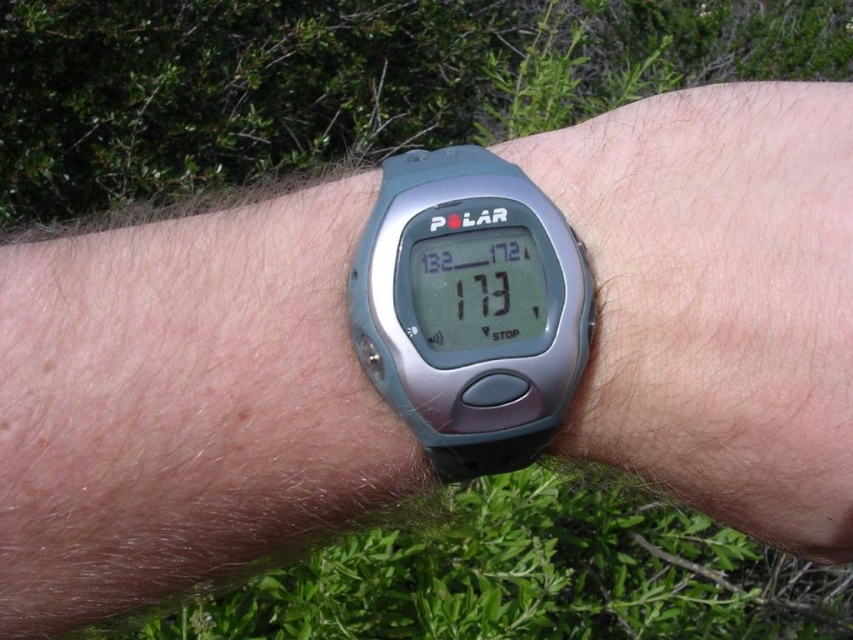
Is point (663, 408) positioned in front of point (448, 244)?

No, it is not.

Find the location of a particular element. The height and width of the screenshot is (640, 853). satin silver watch at center is located at coordinates (718, 300).